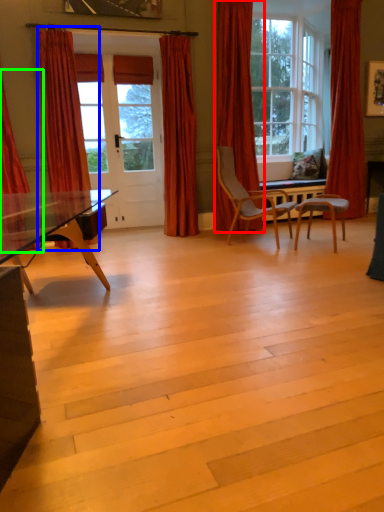
Question: Which is nearer to the curtain (highlighted by a red box)? curtain (highlighted by a blue box) or curtain (highlighted by a green box).

Choices:
 (A) curtain
 (B) curtain

Answer: (A)